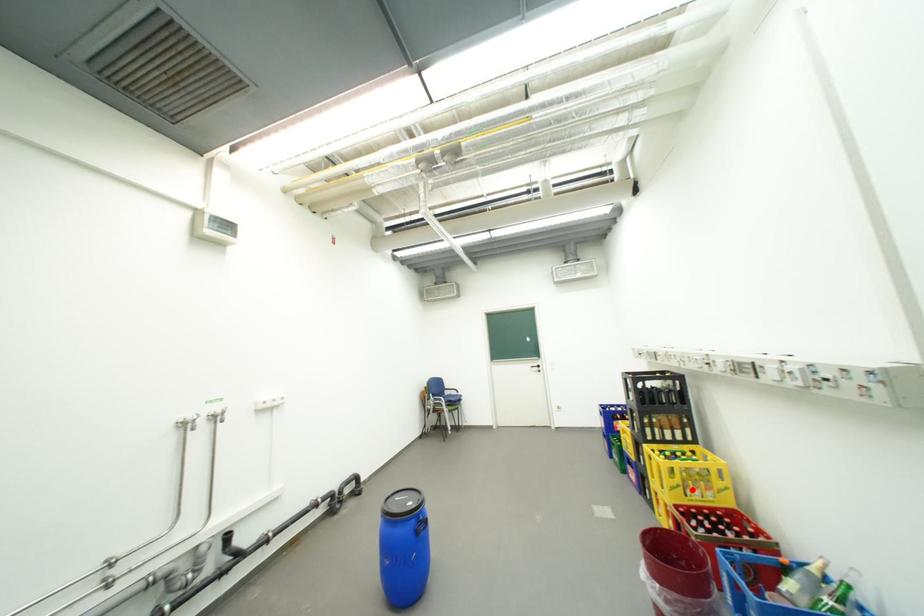
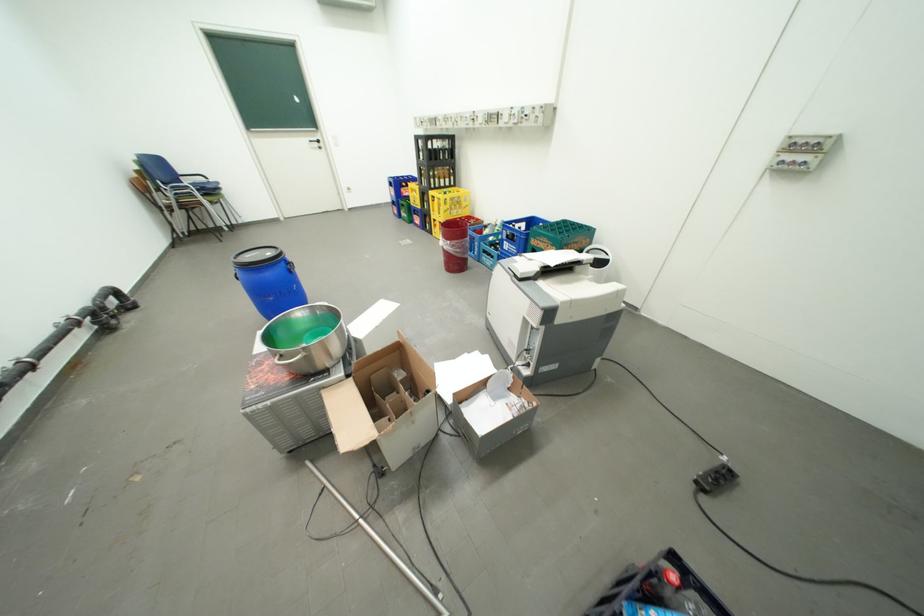
Locate, in the second image, the point that corresponds to the highlighted location in the first image.

(459, 212)